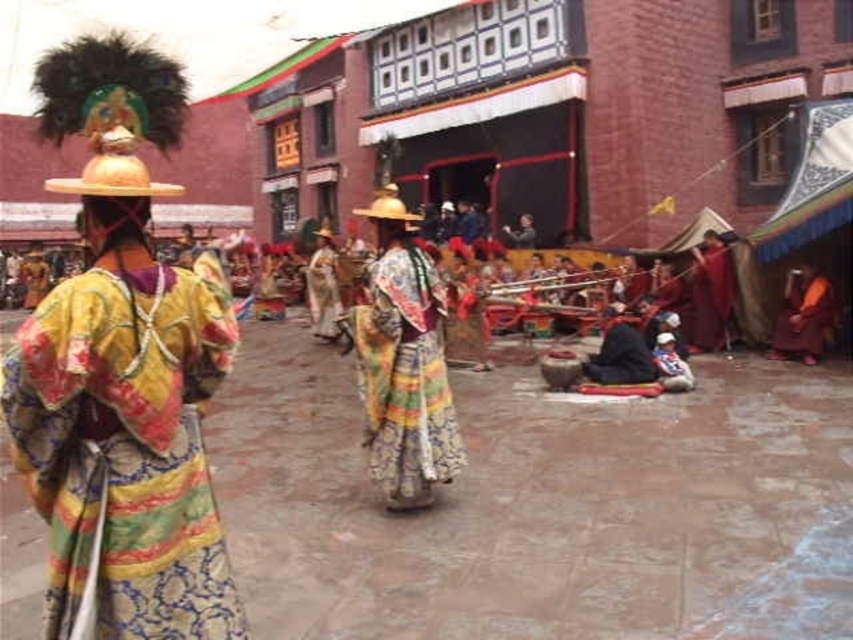
Question: Where is multicolored brocade robe at center located in relation to multicolored silk dress at center in the image?

Choices:
 (A) right
 (B) left

Answer: (B)

Question: Is the position of multicolored brocade robe at center more distant than that of multicolored silk dress at center?

Choices:
 (A) yes
 (B) no

Answer: (B)

Question: Where is multicolored brocade robe at center located in relation to multicolored silk dress at center in the image?

Choices:
 (A) below
 (B) above

Answer: (A)

Question: Which point appears farthest from the camera in this image?

Choices:
 (A) (422, 368)
 (B) (199, 605)

Answer: (A)

Question: Which of the following is the farthest from the observer?

Choices:
 (A) multicolored brocade robe at center
 (B) multicolored silk dress at center

Answer: (B)